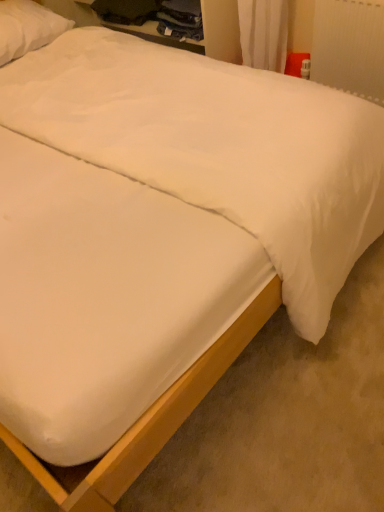
Question: Considering the relative sizes of white plastic radiator at upper right and white smooth mattress at center in the image provided, is white plastic radiator at upper right bigger than white smooth mattress at center?

Choices:
 (A) no
 (B) yes

Answer: (A)

Question: Can we say white plastic radiator at upper right lies outside white smooth mattress at center?

Choices:
 (A) yes
 (B) no

Answer: (A)

Question: Considering the relative sizes of white plastic radiator at upper right and white smooth mattress at center in the image provided, is white plastic radiator at upper right thinner than white smooth mattress at center?

Choices:
 (A) yes
 (B) no

Answer: (A)

Question: From a real-world perspective, is white plastic radiator at upper right beneath white smooth mattress at center?

Choices:
 (A) no
 (B) yes

Answer: (A)

Question: Considering the relative sizes of white plastic radiator at upper right and white smooth mattress at center in the image provided, is white plastic radiator at upper right taller than white smooth mattress at center?

Choices:
 (A) yes
 (B) no

Answer: (A)

Question: Considering the relative sizes of white plastic radiator at upper right and white smooth mattress at center in the image provided, is white plastic radiator at upper right smaller than white smooth mattress at center?

Choices:
 (A) yes
 (B) no

Answer: (A)

Question: Is white soft pillow at upper left smaller than white plastic radiator at upper right?

Choices:
 (A) yes
 (B) no

Answer: (B)

Question: Would you consider white soft pillow at upper left to be distant from white plastic radiator at upper right?

Choices:
 (A) yes
 (B) no

Answer: (A)

Question: Is white soft pillow at upper left touching white plastic radiator at upper right?

Choices:
 (A) no
 (B) yes

Answer: (A)

Question: Can you confirm if white soft pillow at upper left is shorter than white plastic radiator at upper right?

Choices:
 (A) no
 (B) yes

Answer: (B)

Question: Could you tell me if white soft pillow at upper left is facing white plastic radiator at upper right?

Choices:
 (A) yes
 (B) no

Answer: (A)

Question: Is white soft pillow at upper left further to camera compared to white plastic radiator at upper right?

Choices:
 (A) yes
 (B) no

Answer: (A)

Question: From a real-world perspective, is white smooth mattress at center located higher than white soft pillow at upper left?

Choices:
 (A) yes
 (B) no

Answer: (B)